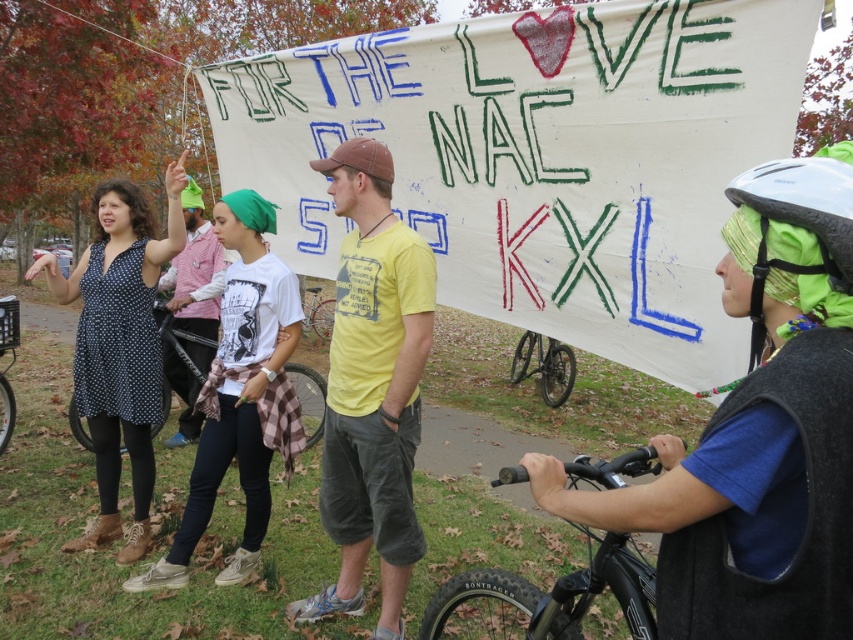
Does yellow cotton t-shirt at center appear on the left side of metallic silver bicycle at center?

No, yellow cotton t-shirt at center is not to the left of metallic silver bicycle at center.

Does yellow cotton t-shirt at center lie behind metallic silver bicycle at center?

No, yellow cotton t-shirt at center is closer to the viewer.

The height and width of the screenshot is (640, 853). Identify the location of yellow cotton t-shirt at center. (372, 388).

Locate an element on the screen. This screenshot has width=853, height=640. yellow cotton t-shirt at center is located at coordinates (372, 388).

Is yellow cotton t-shirt at center positioned behind white matte bicycle helmet at right?

That is True.

Which is in front, point (357, 344) or point (820, 198)?

Positioned in front is point (820, 198).

What are the coordinates of `yellow cotton t-shirt at center` in the screenshot? It's located at pos(372,388).

Identify the location of yellow cotton t-shirt at center. (372, 388).

Between point (502, 467) and point (326, 337), which one is positioned in front?

Point (502, 467) is in front.

Between black matte bicycle at lower right and metallic silver bicycle at center, which one has less height?

black matte bicycle at lower right

Is point (554, 592) closer to viewer compared to point (325, 307)?

Yes.

You are a GUI agent. You are given a task and a screenshot of the screen. Output one action in this format:
    pyautogui.click(x=<x>, y=<y>)
    Task: Click on the black matte bicycle at lower right
    The image size is (853, 640).
    Given the screenshot: What is the action you would take?
    pyautogui.click(x=553, y=595)